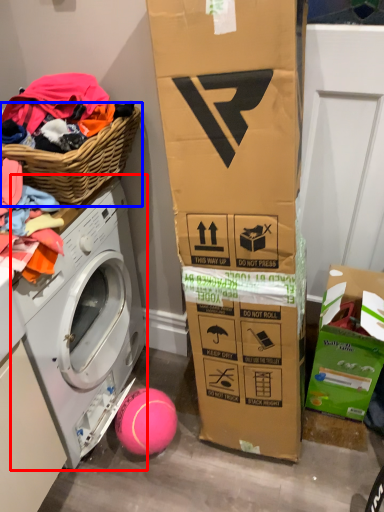
Question: Among these objects, which one is nearest to the camera, washing machine (highlighted by a red box) or basket (highlighted by a blue box)?

Choices:
 (A) washing machine
 (B) basket

Answer: (B)